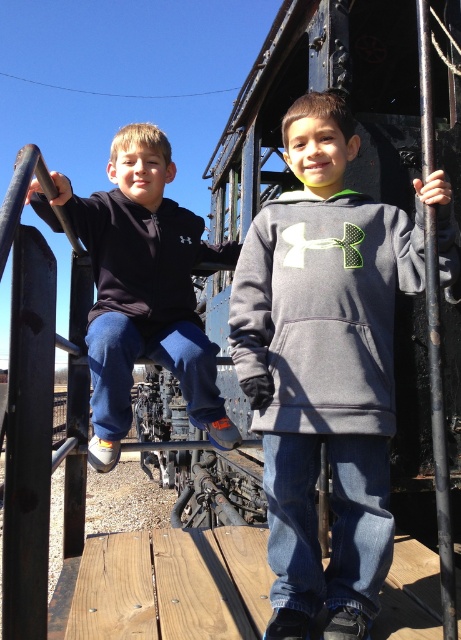
You are taking a photo of the two boys standing on the wooden platform beside the vintage train car. You want to focus on the point closer to the camera between the two points marked as point 1 at (370,492) and point 2 at (303,333). Which point should you focus on?

You should focus on point 1 at (370,492) because it is closer to the camera than point 2 at (303,333).

Based on the photo, you are a photographer trying to capture a photo of the matte black hoodie at left and the black metal pole at right. Based on their positions, which object is higher in the image?

The matte black hoodie at left is higher in the image than the black metal pole at right.

You are standing at the point labeled point (135, 241) and want to walk to the point labeled point (448, 602). Which direction should you face to walk towards your destination?

Since point (135, 241) is behind point (448, 602), you should face forward to walk towards your destination.